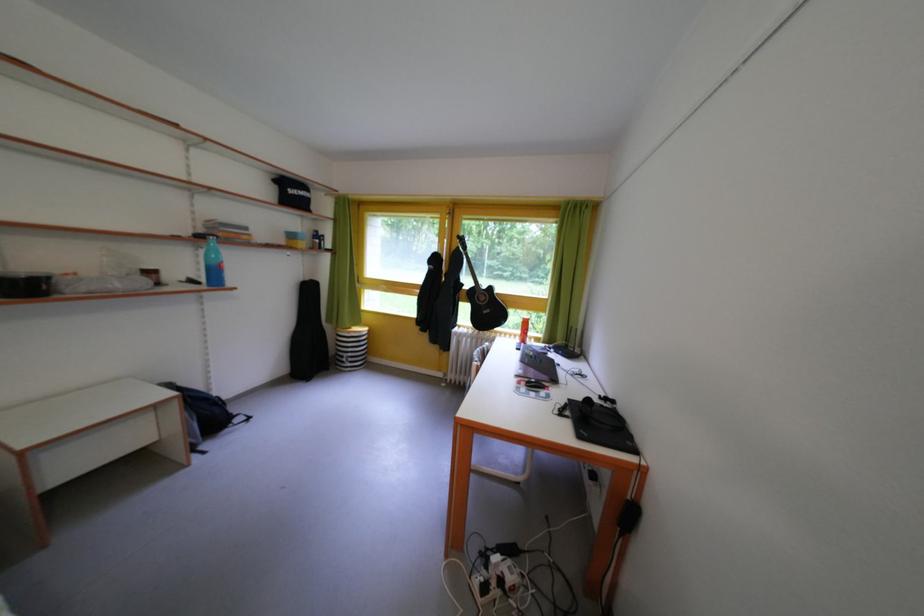
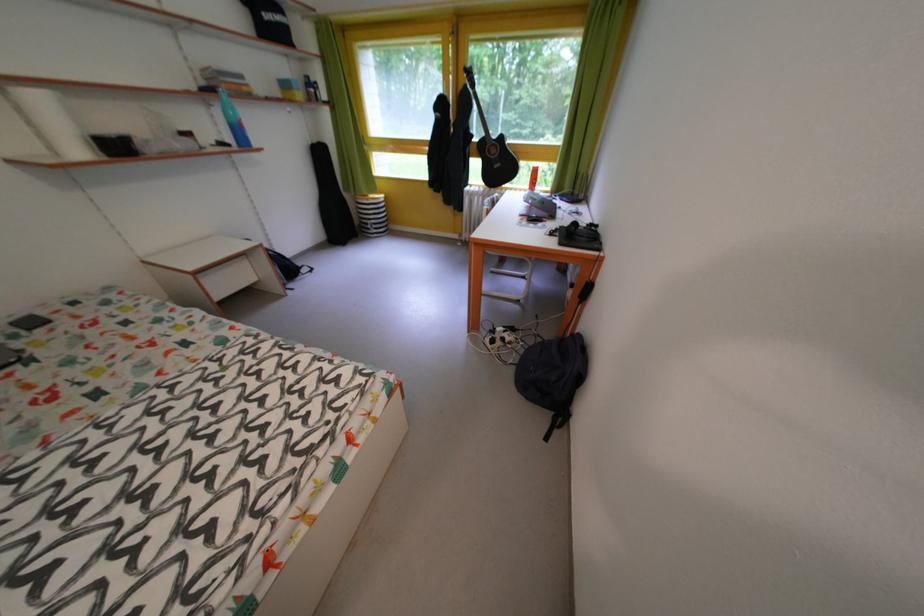
Question: The first image is from the beginning of the video and the second image is from the end. How did the camera likely rotate when shooting the video?

Choices:
 (A) Left
 (B) Right
 (C) Up
 (D) Down

Answer: (D)